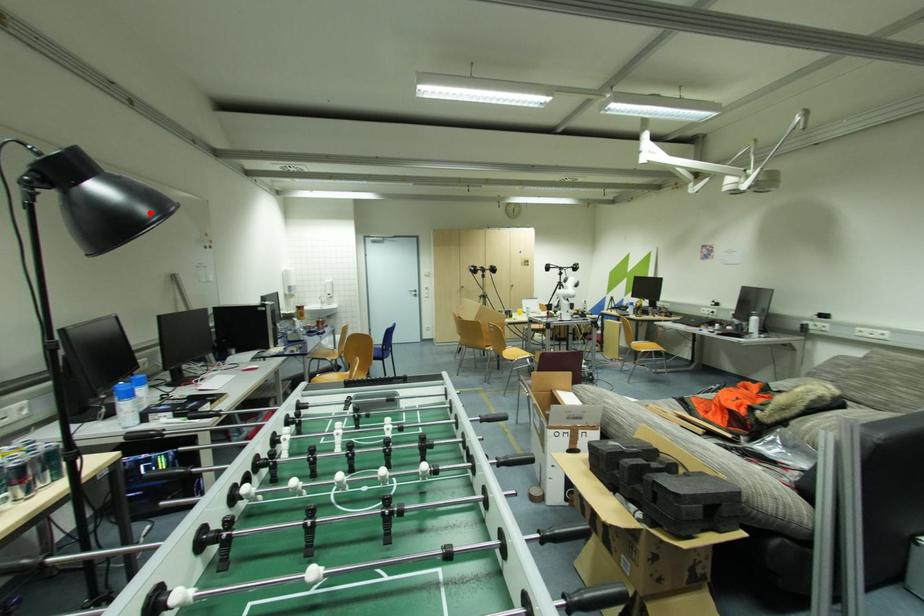
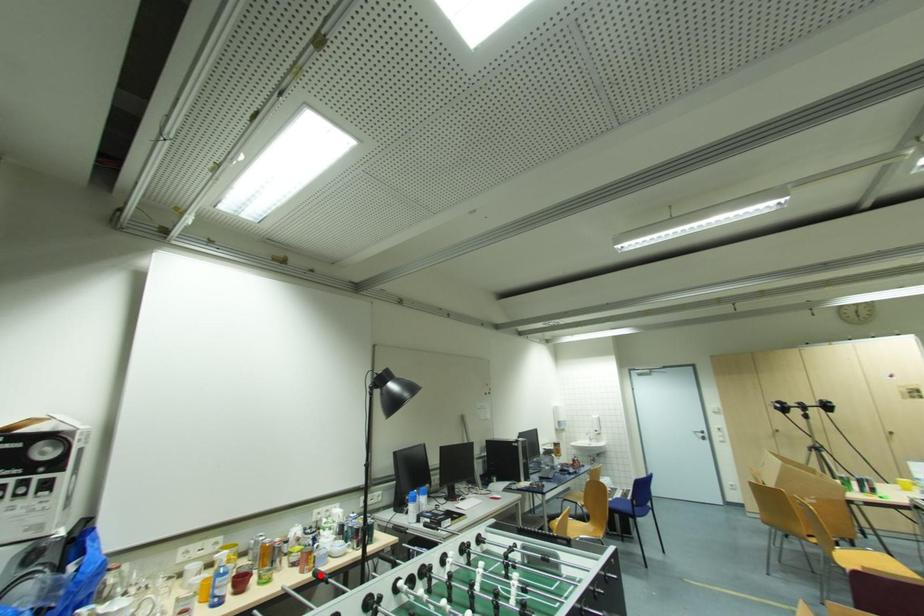
I am providing you with two images of the same scene from different viewpoints. A red point is marked on the first image and another point is marked on the second image. Is the red point in image1 aligned with the point shown in image2?

No